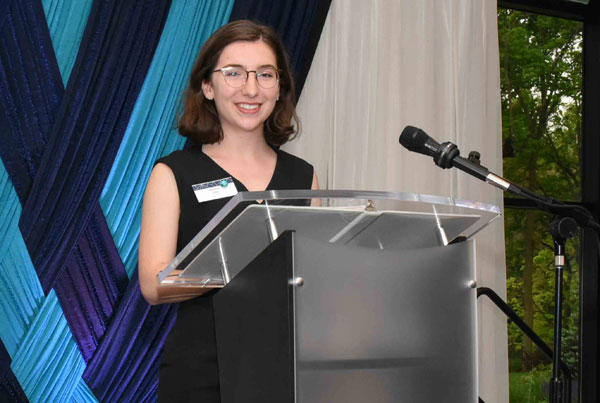
Find the location of a particular element. The width and height of the screenshot is (600, 403). speaker is located at coordinates (252, 175).